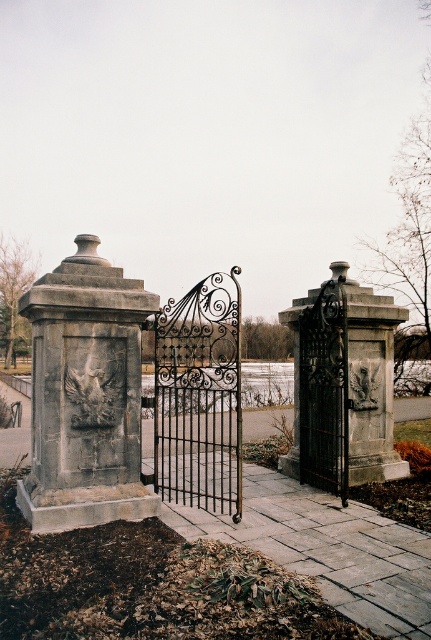
Question: Which of the following is the farthest from the observer?

Choices:
 (A) gray stone monument at left
 (B) black wrought iron gate at center

Answer: (B)

Question: Is stone textured gate at right thinner than black wrought iron gate at center?

Choices:
 (A) no
 (B) yes

Answer: (A)

Question: Considering the real-world distances, which object is farthest from the gray stone monument at left?

Choices:
 (A) stone textured gate at right
 (B) black wrought iron gate at center

Answer: (A)

Question: Is stone textured gate at right bigger than black wrought iron gate at center?

Choices:
 (A) no
 (B) yes

Answer: (B)

Question: Which object is the closest to the black wrought iron gate at center?

Choices:
 (A) stone textured gate at right
 (B) gray stone monument at left

Answer: (A)

Question: From the image, what is the correct spatial relationship of gray stone monument at left in relation to black wrought iron gate at center?

Choices:
 (A) below
 (B) above

Answer: (B)